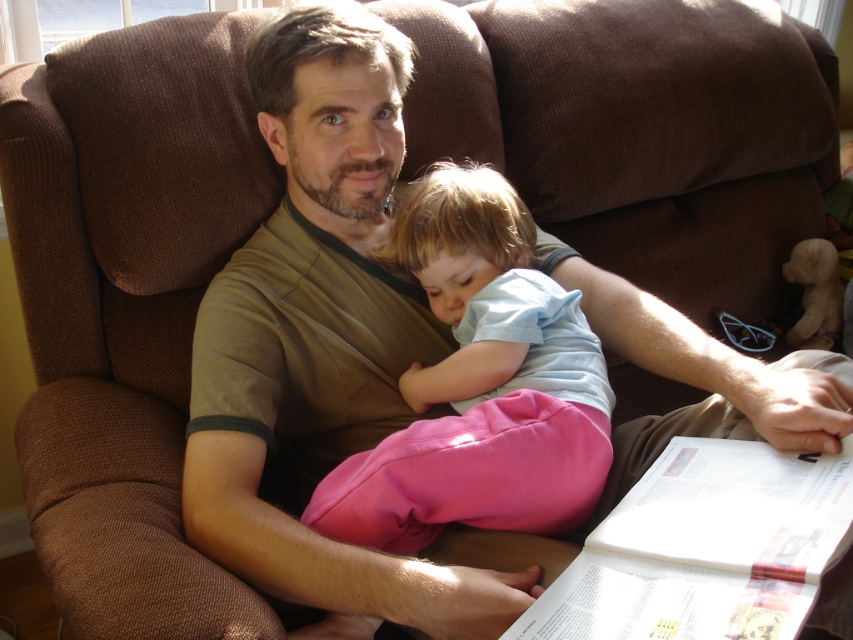
Question: Which point is farther from the camera taking this photo?

Choices:
 (A) (421, 262)
 (B) (763, 464)

Answer: (A)

Question: Is pink cotton pants at center closer to camera compared to white paper book at lower right?

Choices:
 (A) no
 (B) yes

Answer: (A)

Question: Is pink cotton pants at center positioned at the back of white paper book at lower right?

Choices:
 (A) yes
 (B) no

Answer: (A)

Question: Does pink cotton pants at center have a lesser width compared to white paper book at lower right?

Choices:
 (A) no
 (B) yes

Answer: (B)